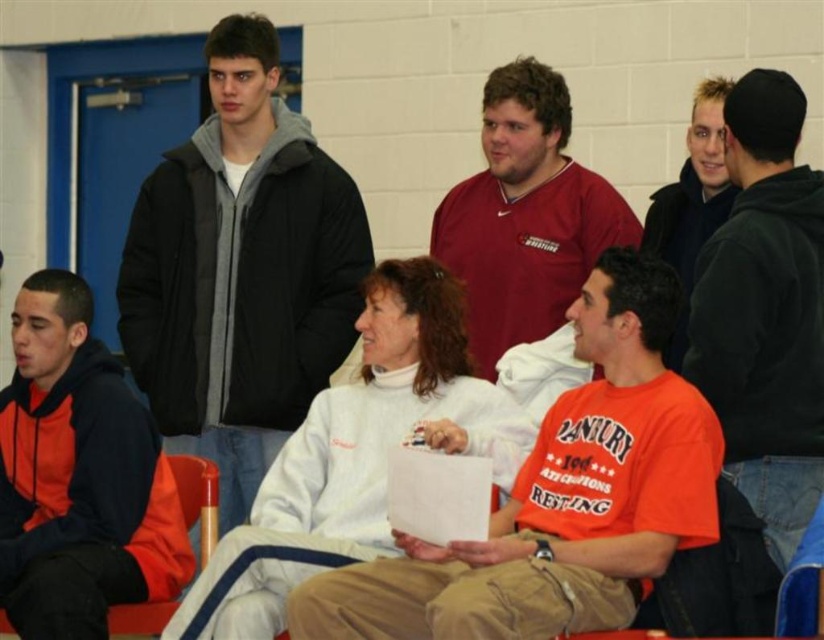
Who is taller, white fleece jacket at center or orange fleece sweatshirt at left?

orange fleece sweatshirt at left is taller.

In the scene shown: Is white fleece jacket at center shorter than orange fleece sweatshirt at left?

Indeed, white fleece jacket at center has a lesser height compared to orange fleece sweatshirt at left.

The width and height of the screenshot is (824, 640). What do you see at coordinates (356, 456) in the screenshot?
I see `white fleece jacket at center` at bounding box center [356, 456].

Where is `white fleece jacket at center`? white fleece jacket at center is located at coordinates (356, 456).

Between black hoodie at upper right and blonde hair man at upper right, which one is positioned lower?

Positioned lower is black hoodie at upper right.

Is black hoodie at upper right below blonde hair man at upper right?

Indeed, black hoodie at upper right is positioned under blonde hair man at upper right.

Does point (792, 538) come farther from viewer compared to point (714, 198)?

No, it is not.

Where is `black hoodie at upper right`? Image resolution: width=824 pixels, height=640 pixels. black hoodie at upper right is located at coordinates (765, 310).

Between orange fleece sweatshirt at left and black hoodie at upper right, which one appears on the right side from the viewer's perspective?

black hoodie at upper right is more to the right.

This screenshot has height=640, width=824. Identify the location of orange fleece sweatshirt at left. (78, 476).

The image size is (824, 640). What do you see at coordinates (78, 476) in the screenshot?
I see `orange fleece sweatshirt at left` at bounding box center [78, 476].

Where is `orange fleece sweatshirt at left`? The height and width of the screenshot is (640, 824). orange fleece sweatshirt at left is located at coordinates (78, 476).